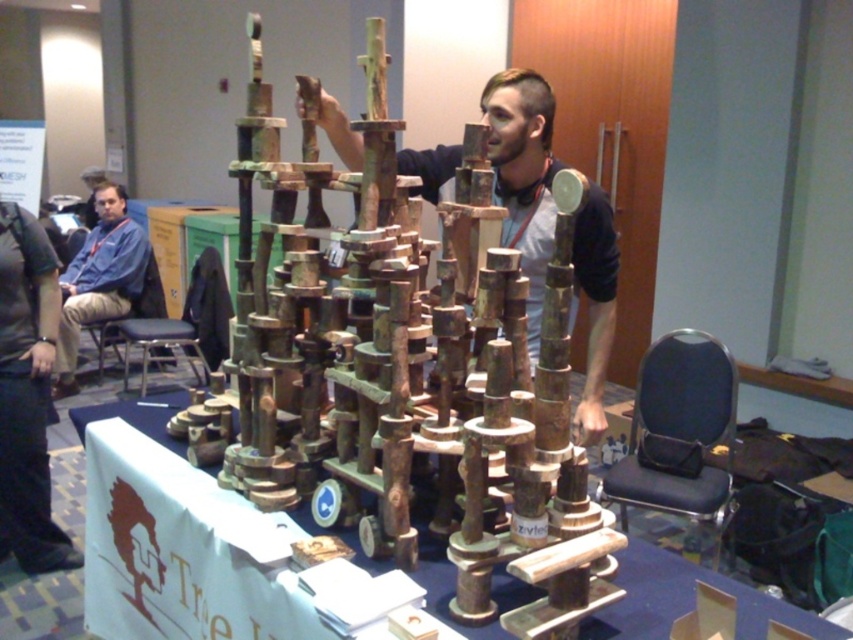
Is wooden sculpture at center in front of blue shirt at left?

Yes, wooden sculpture at center is in front of blue shirt at left.

Image resolution: width=853 pixels, height=640 pixels. What do you see at coordinates (523, 173) in the screenshot? I see `wooden sculpture at center` at bounding box center [523, 173].

Where is `wooden sculpture at center`? The height and width of the screenshot is (640, 853). wooden sculpture at center is located at coordinates (523, 173).

Where is `wooden sculpture at center`? The height and width of the screenshot is (640, 853). wooden sculpture at center is located at coordinates (523, 173).

Between point (534, 266) and point (204, 371), which one is positioned in front?

Point (534, 266) is more forward.

Find the location of a particular element. The height and width of the screenshot is (640, 853). wooden sculpture at center is located at coordinates (523, 173).

Who is more distant from viewer, (x=469, y=486) or (x=117, y=305)?

The point (x=117, y=305) is more distant.

Which of these two, rusty wood sculpture at center or blue shirt at left, stands shorter?

rusty wood sculpture at center

Does point (306, 148) come farther from viewer compared to point (138, 268)?

No, it is not.

Find the location of `rusty wood sculpture at center`. rusty wood sculpture at center is located at coordinates (403, 356).